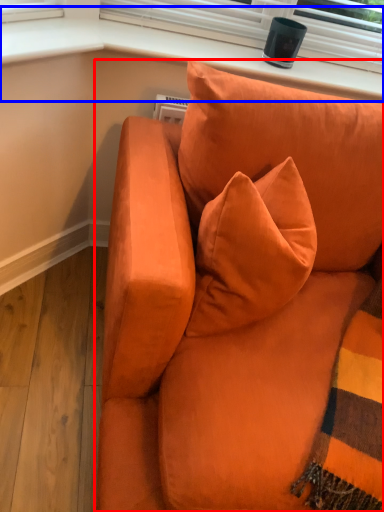
Question: Among these objects, which one is nearest to the camera, studio couch (highlighted by a red box) or window sill (highlighted by a blue box)?

Choices:
 (A) studio couch
 (B) window sill

Answer: (A)